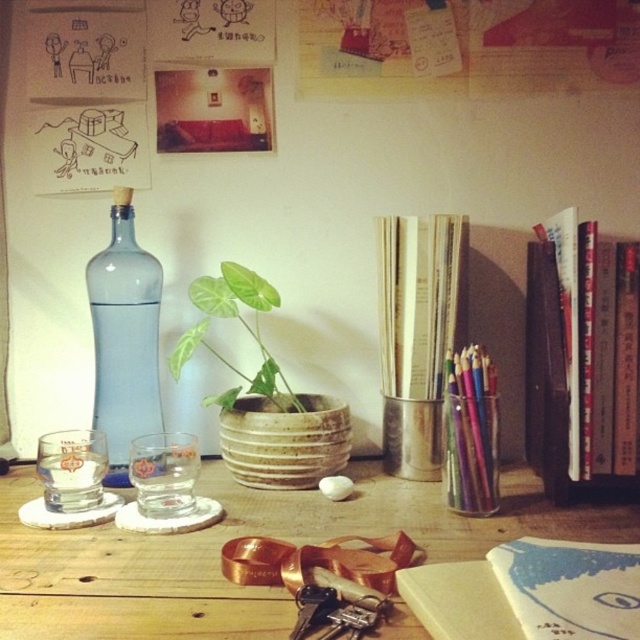
Which is more to the right, hardcover book at center or transparent glass bottle at left?

Positioned to the right is hardcover book at center.

Does hardcover book at center appear on the left side of transparent glass bottle at left?

Incorrect, hardcover book at center is not on the left side of transparent glass bottle at left.

This screenshot has height=640, width=640. What do you see at coordinates (529, 593) in the screenshot? I see `hardcover book at center` at bounding box center [529, 593].

Locate an element on the screen. hardcover book at center is located at coordinates (529, 593).

Can you confirm if metallic glass pencil holder at center right is shorter than transparent glass at lower left?

Incorrect, metallic glass pencil holder at center right's height does not fall short of transparent glass at lower left's.

Which is behind, point (477, 362) or point (72, 458)?

The point (477, 362) is behind.

Where is `metallic glass pencil holder at center right`? The width and height of the screenshot is (640, 640). metallic glass pencil holder at center right is located at coordinates (472, 432).

Does hardcover books at right have a greater height compared to transparent glass bottle at left?

No, hardcover books at right is not taller than transparent glass bottle at left.

Between point (589, 436) and point (92, 269), which one is positioned behind?

Point (92, 269)

The height and width of the screenshot is (640, 640). Find the location of `hardcover books at right`. hardcover books at right is located at coordinates (561, 356).